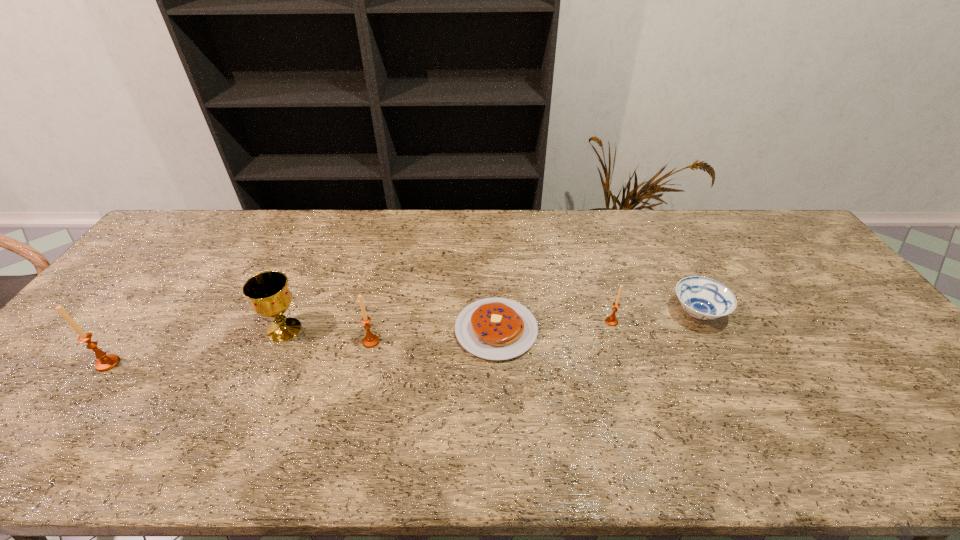
Identify the location of the leftmost object. The width and height of the screenshot is (960, 540). click(105, 362).

Where is `the nearest candle_holder`? the nearest candle_holder is located at coordinates (105, 362).

You are a GUI agent. You are given a task and a screenshot of the screen. Output one action in this format:
    pyautogui.click(x=<x>, y=<y>)
    Task: Click on the second nearest candle_holder
    
    Given the screenshot: What is the action you would take?
    [x=371, y=340]

You are a GUI agent. You are given a task and a screenshot of the screen. Output one action in this format:
    pyautogui.click(x=<x>, y=<y>)
    Task: Click on the third object from left to right
    The height and width of the screenshot is (540, 960).
    Given the screenshot: What is the action you would take?
    pyautogui.click(x=371, y=340)

In order to click on the third shortest object in this screenshot , I will do `click(611, 320)`.

At what (x,y) coordinates should I click in order to perform the action: click on the fifth object from left to right. Please return your answer as a coordinate pair (x, y). Looking at the image, I should click on (611, 320).

Where is `the fifth object from right to left`? the fifth object from right to left is located at coordinates (268, 292).

Locate an element on the screen. This screenshot has height=540, width=960. pancake is located at coordinates (494, 328).

I want to click on the third object from right to left, so click(494, 328).

At what (x,y) coordinates should I click in order to perform the action: click on the second shortest object. Please return your answer as a coordinate pair (x, y). The image size is (960, 540). Looking at the image, I should click on (703, 298).